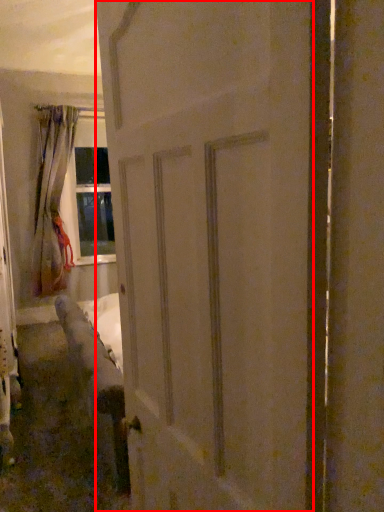
Question: From the image, what is the correct spatial relationship of door (annotated by the red box) in relation to curtain?

Choices:
 (A) left
 (B) right

Answer: (B)